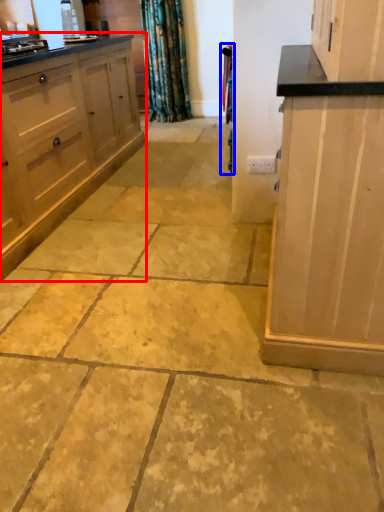
Question: Among these objects, which one is nearest to the camera, cabinetry (highlighted by a red box) or curtain (highlighted by a blue box)?

Choices:
 (A) cabinetry
 (B) curtain

Answer: (A)